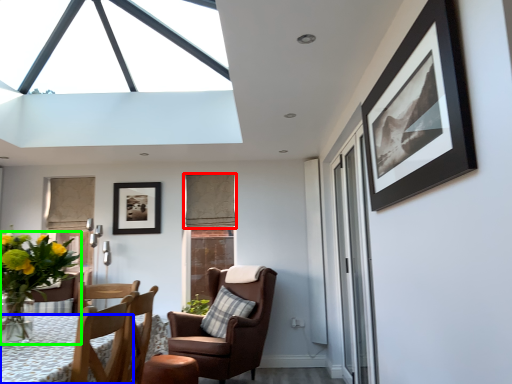
Question: Which is nearer to the curtain (highlighted by a red box)? desk (highlighted by a blue box) or houseplant (highlighted by a green box).

Choices:
 (A) desk
 (B) houseplant

Answer: (B)